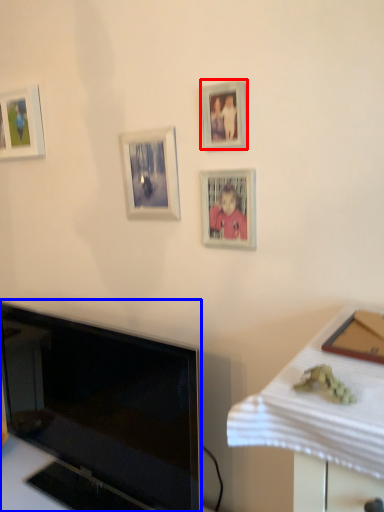
Question: Which of the following is the closest to the observer, picture frame (highlighted by a red box) or television (highlighted by a blue box)?

Choices:
 (A) picture frame
 (B) television

Answer: (B)